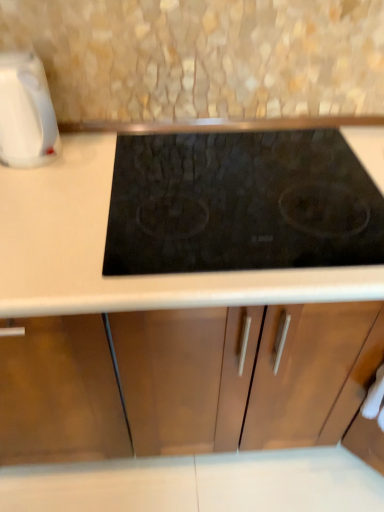
In order to click on unoccupied region to the right of white glossy kettle at left in this screenshot , I will do `click(96, 160)`.